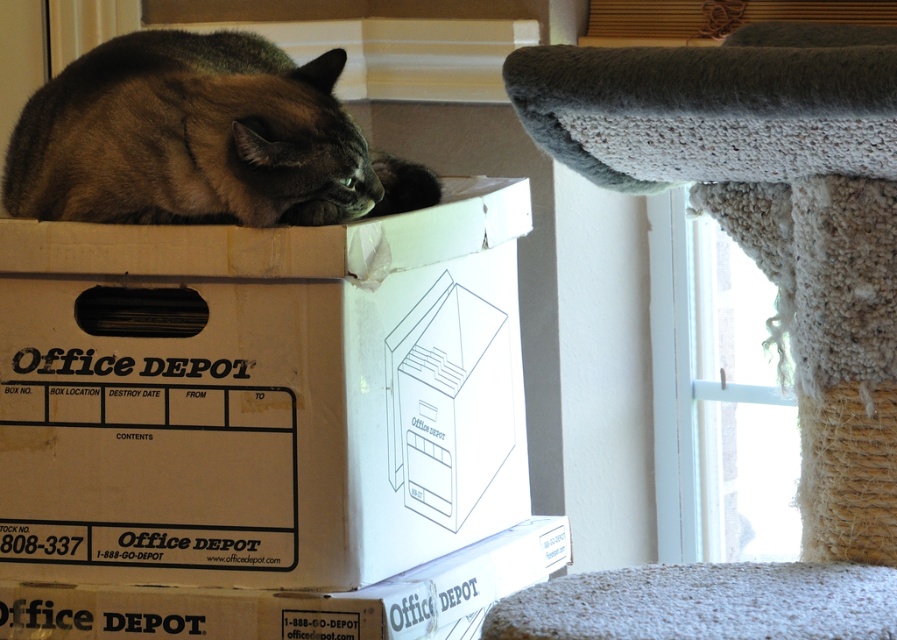
Question: Which point is farther to the camera?

Choices:
 (A) dark brown fur cat at upper left
 (B) matte brown cardboard box at center

Answer: (B)

Question: Does white cardboard box at center appear over dark brown fur cat at upper left?

Choices:
 (A) yes
 (B) no

Answer: (B)

Question: Is dark brown fur cat at upper left bigger than matte brown cardboard box at center?

Choices:
 (A) yes
 (B) no

Answer: (A)

Question: Is white cardboard box at center below textured gray carpet at lower right?

Choices:
 (A) yes
 (B) no

Answer: (B)

Question: Among these points, which one is farthest from the camera?

Choices:
 (A) (274, 602)
 (B) (187, 561)

Answer: (B)

Question: Which of the following is the closest to the observer?

Choices:
 (A) (168, 108)
 (B) (804, 573)

Answer: (B)